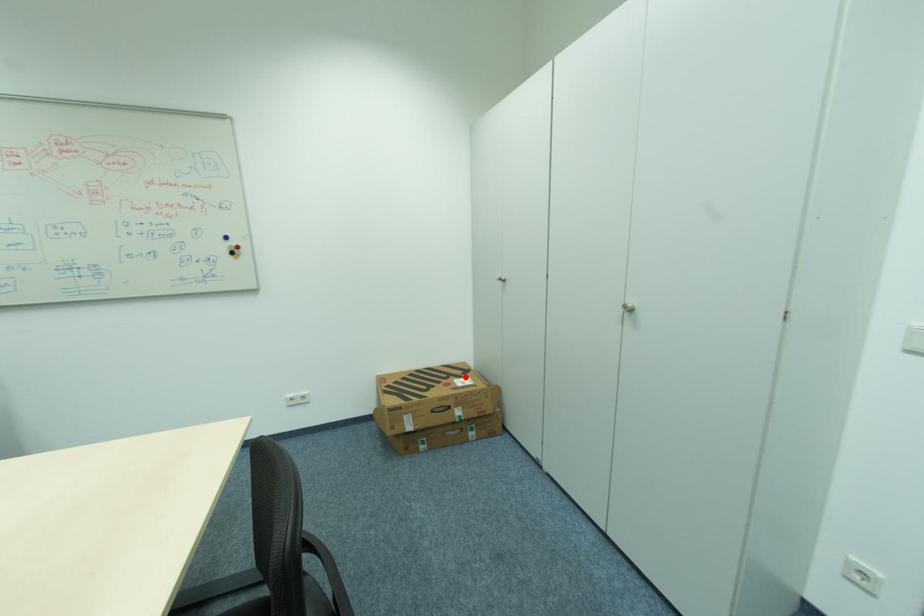
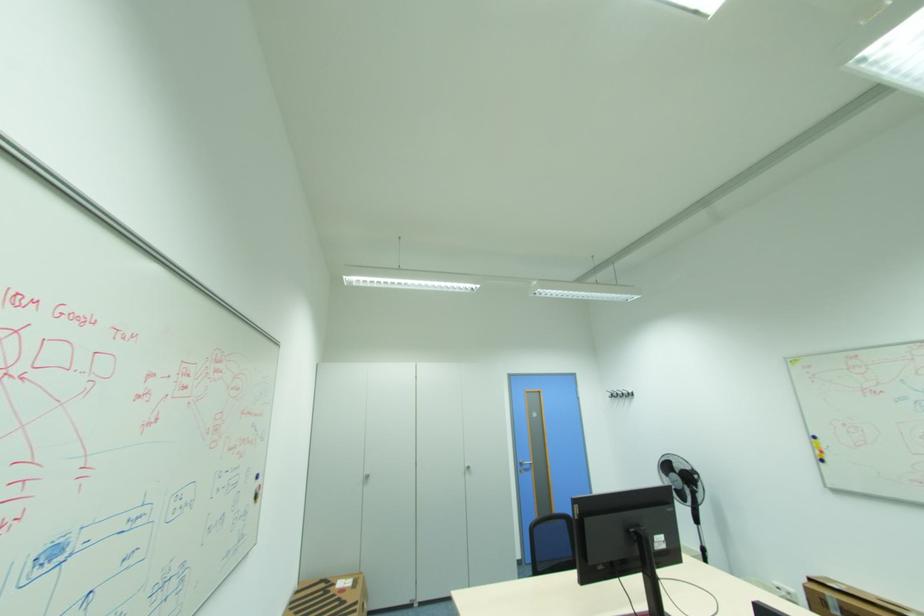
Locate, in the second image, the point that corresponds to the highlighted location in the first image.

(338, 585)